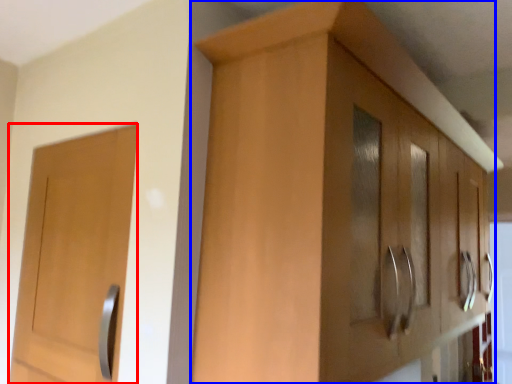
Question: Among these objects, which one is farthest to the camera, door (highlighted by a red box) or cabinetry (highlighted by a blue box)?

Choices:
 (A) door
 (B) cabinetry

Answer: (A)